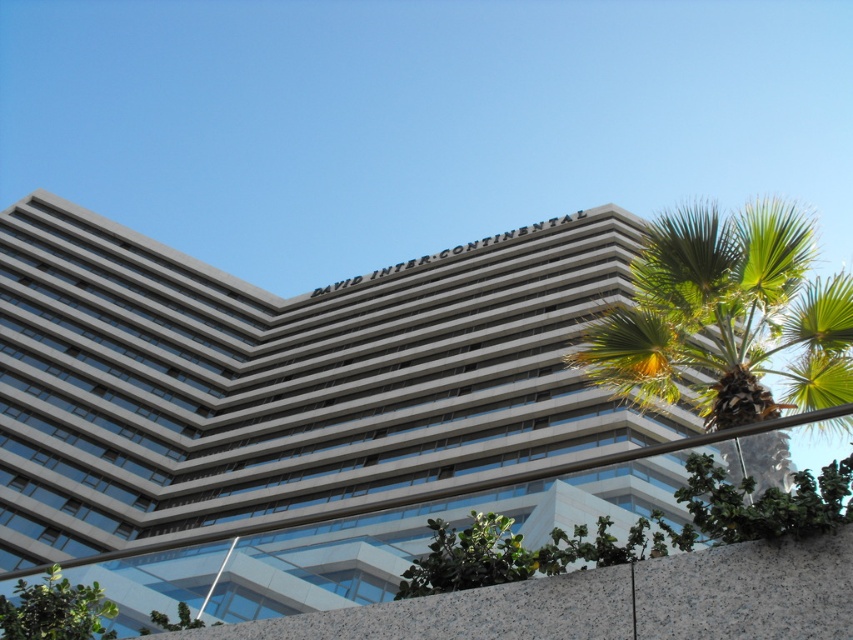
Is green leafy palm tree at right to the left of green leafy plant at lower center from the viewer's perspective?

Incorrect, green leafy palm tree at right is not on the left side of green leafy plant at lower center.

Does green leafy palm tree at right appear on the right side of green leafy plant at lower center?

Yes, green leafy palm tree at right is to the right of green leafy plant at lower center.

Between point (805, 228) and point (492, 541), which one is positioned behind?

Point (805, 228)

Find the location of a particular element. green leafy palm tree at right is located at coordinates (726, 317).

Between green leafy palm tree at right and green leafy tree at lower left, which one has more height?

With more height is green leafy palm tree at right.

Is green leafy palm tree at right smaller than green leafy tree at lower left?

No.

You are a GUI agent. You are given a task and a screenshot of the screen. Output one action in this format:
    pyautogui.click(x=<x>, y=<y>)
    Task: Click on the green leafy palm tree at right
    This screenshot has width=853, height=640.
    Given the screenshot: What is the action you would take?
    pyautogui.click(x=726, y=317)

Between green leafy plant at lower center and green leafy tree at lower left, which one appears on the left side from the viewer's perspective?

green leafy tree at lower left is more to the left.

Can you confirm if green leafy plant at lower center is positioned above green leafy tree at lower left?

Yes, green leafy plant at lower center is above green leafy tree at lower left.

I want to click on green leafy plant at lower center, so click(x=468, y=557).